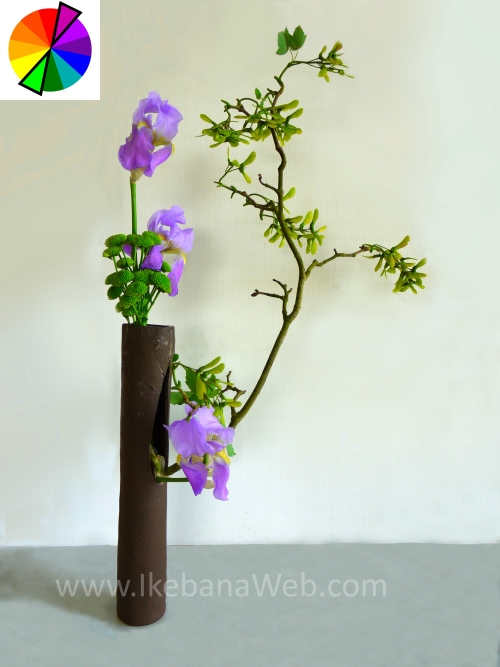
The height and width of the screenshot is (667, 500). In order to click on vase in this screenshot , I will do `click(137, 511)`.